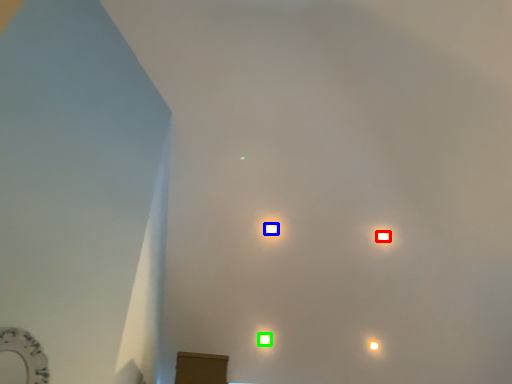
Question: Considering the real-world distances, which object is farthest from lamp (highlighted by a red box)? lamp (highlighted by a blue box) or lamp (highlighted by a green box)?

Choices:
 (A) lamp
 (B) lamp

Answer: (B)